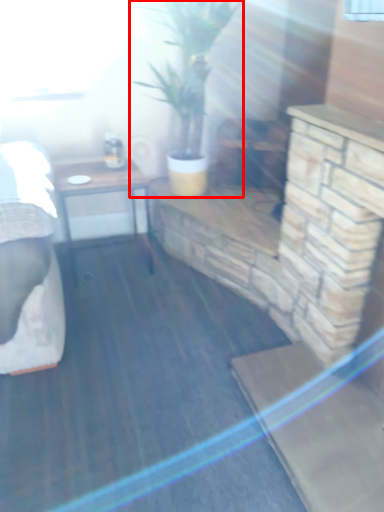
Question: Considering the relative positions of houseplant (annotated by the red box) and table in the image provided, where is houseplant (annotated by the red box) located with respect to the staircase?

Choices:
 (A) left
 (B) right

Answer: (B)